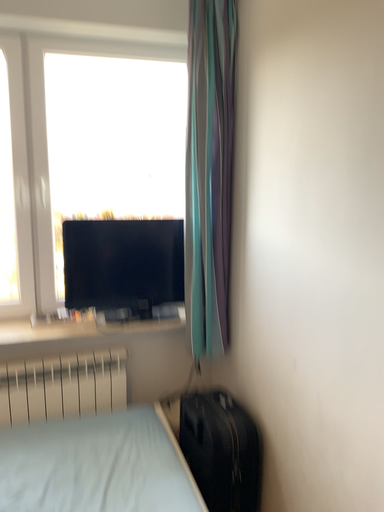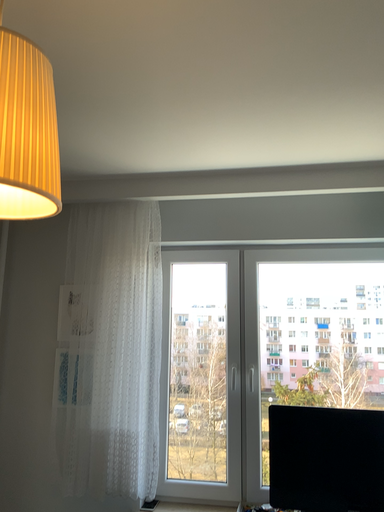
Question: How did the camera likely rotate when shooting the video?

Choices:
 (A) rotated right
 (B) rotated left

Answer: (B)